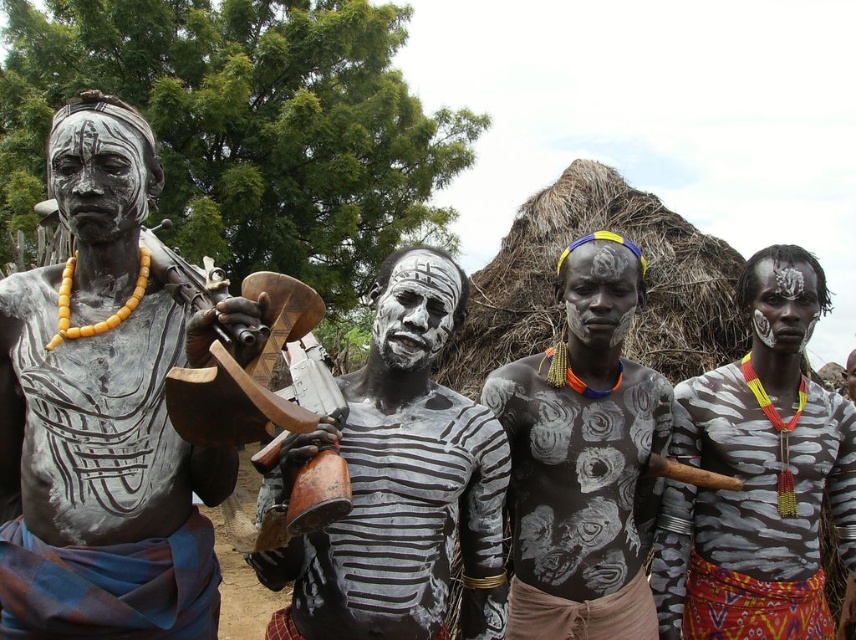
Question: Which of the following is the farthest from the observer?

Choices:
 (A) (805, 280)
 (B) (789, 346)
 (C) (849, 356)
 (D) (575, 243)

Answer: (C)

Question: Observing the image, what is the correct spatial positioning of matte black statue at left in reference to gray matte face at center?

Choices:
 (A) right
 (B) left

Answer: (B)

Question: Which of the following is the farthest from the observer?

Choices:
 (A) (355, 604)
 (B) (110, 237)
 (C) (438, 308)

Answer: (C)

Question: Is white painted body at center wider than matte black face at center?

Choices:
 (A) yes
 (B) no

Answer: (B)

Question: Is black textured body paint at center to the right of gray matte face at center from the viewer's perspective?

Choices:
 (A) yes
 (B) no

Answer: (B)

Question: Which of the following is the farthest from the observer?

Choices:
 (A) (801, 321)
 (B) (418, 333)
 (C) (732, 445)

Answer: (A)